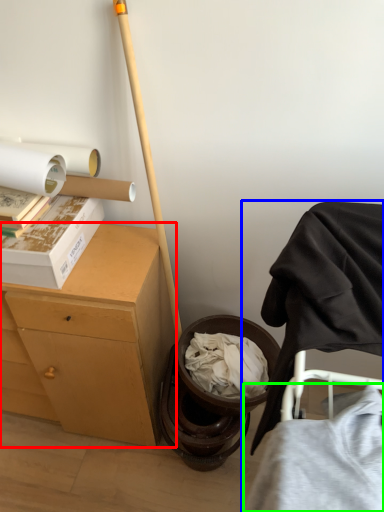
Question: Estimate the real-world distances between objects in this image. Which object is closer to desk (highlighted by a red box), furniture (highlighted by a blue box) or clothing (highlighted by a green box)?

Choices:
 (A) furniture
 (B) clothing

Answer: (A)